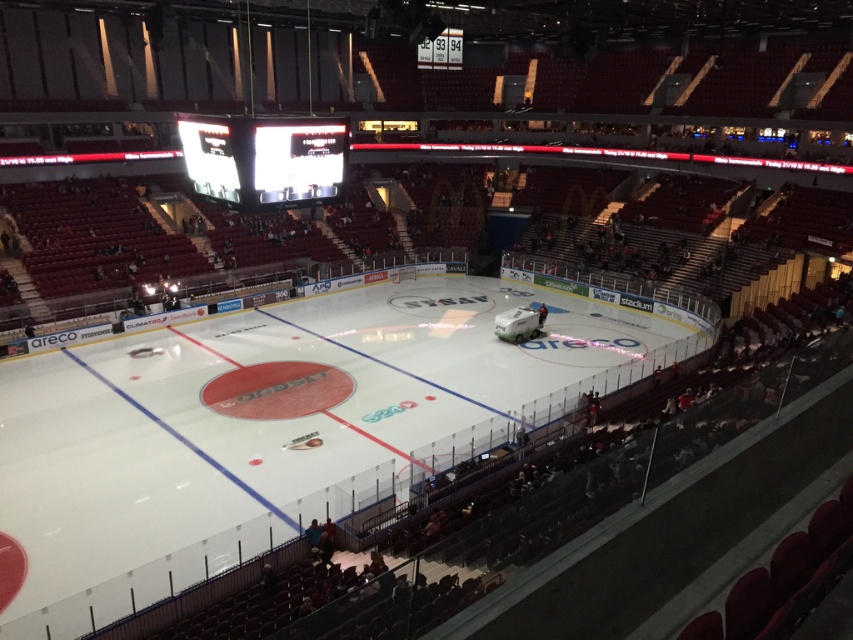
Does white smooth ice at center have a greater height compared to white glossy scoreboard at upper center?

Yes.

In the scene shown: Is white smooth ice at center smaller than white glossy scoreboard at upper center?

Actually, white smooth ice at center might be larger than white glossy scoreboard at upper center.

Is point (483, 397) behind point (282, 186)?

Yes.

I want to click on white smooth ice at center, so click(x=283, y=426).